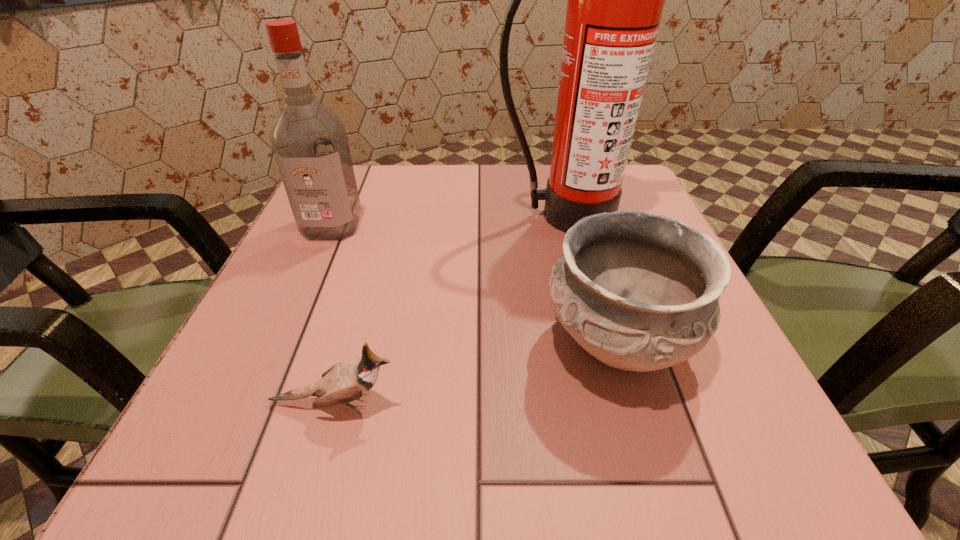
I want to click on free spot between the tallest object and the shortest object, so click(449, 309).

This screenshot has width=960, height=540. I want to click on free space between the second tallest object and the pottery, so click(474, 284).

You are a GUI agent. You are given a task and a screenshot of the screen. Output one action in this format:
    pyautogui.click(x=<x>, y=<y>)
    Task: Click on the empty space between the pottery and the second tallest object
    This screenshot has width=960, height=540.
    Given the screenshot: What is the action you would take?
    pyautogui.click(x=474, y=284)

Where is `object that stands as the closest to the pottery`? The image size is (960, 540). object that stands as the closest to the pottery is located at coordinates (615, 2).

Locate which object ranks second in proximity to the liquor. Please provide its 2D coordinates. Your answer should be formatted as a tuple, i.e. [(x, y)], where the tuple contains the x and y coordinates of a point satisfying the conditions above.

[(344, 382)]

You are a GUI agent. You are given a task and a screenshot of the screen. Output one action in this format:
    pyautogui.click(x=<x>, y=<y>)
    Task: Click on the vacant position in the image that satisfies the following two spatial constraints: 1. on the front-facing side of the fire extinguisher; 2. at the face of the shortest object
    The image size is (960, 540).
    Given the screenshot: What is the action you would take?
    pyautogui.click(x=612, y=403)

Find the location of `free space that satisfies the following two spatial constraints: 1. on the front-facing side of the tallest object; 2. at the face of the shortest object`. free space that satisfies the following two spatial constraints: 1. on the front-facing side of the tallest object; 2. at the face of the shortest object is located at coordinates (612, 403).

The width and height of the screenshot is (960, 540). I want to click on vacant space that satisfies the following two spatial constraints: 1. on the front-facing side of the tallest object; 2. at the face of the shortest object, so click(x=612, y=403).

You are a GUI agent. You are given a task and a screenshot of the screen. Output one action in this format:
    pyautogui.click(x=<x>, y=<y>)
    Task: Click on the vacant space that satisfies the following two spatial constraints: 1. on the front-facing side of the second shortest object; 2. on the right side of the liquor
    This screenshot has height=540, width=960.
    Given the screenshot: What is the action you would take?
    pyautogui.click(x=280, y=342)

Identify the location of free space that satisfies the following two spatial constraints: 1. on the front-facing side of the fire extinguisher; 2. on the left side of the third tallest object. (x=596, y=342).